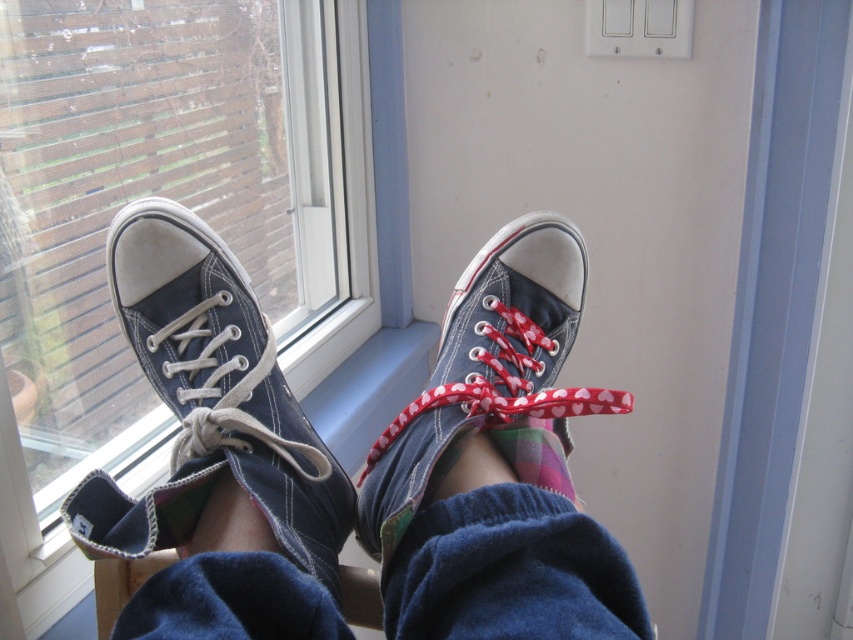
Question: Does dark blue canvas shoe at center appear under matte blue canvas shoe at center?

Choices:
 (A) yes
 (B) no

Answer: (B)

Question: Among these points, which one is nearest to the camera?

Choices:
 (A) (192, 259)
 (B) (376, 547)
 (C) (192, 35)
 (D) (473, 346)

Answer: (B)

Question: Does transparent glass window at left appear on the right side of dark blue canvas shoe at center?

Choices:
 (A) yes
 (B) no

Answer: (B)

Question: Which of the following is the closest to the observer?

Choices:
 (A) matte blue canvas shoe at center
 (B) transparent glass window at left
 (C) matte blue sneakers at center

Answer: (C)

Question: Can you confirm if dark blue canvas shoe at center is positioned to the right of matte blue canvas shoe at center?

Choices:
 (A) yes
 (B) no

Answer: (B)

Question: Which is nearer to the matte blue sneakers at center?

Choices:
 (A) matte blue canvas shoe at center
 (B) transparent glass window at left
 (C) dark blue canvas shoe at center

Answer: (A)